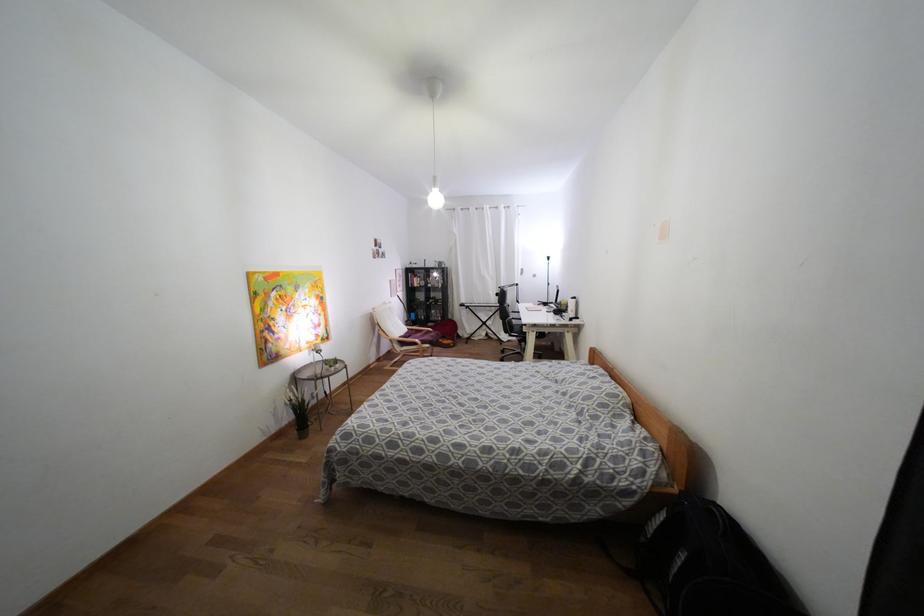
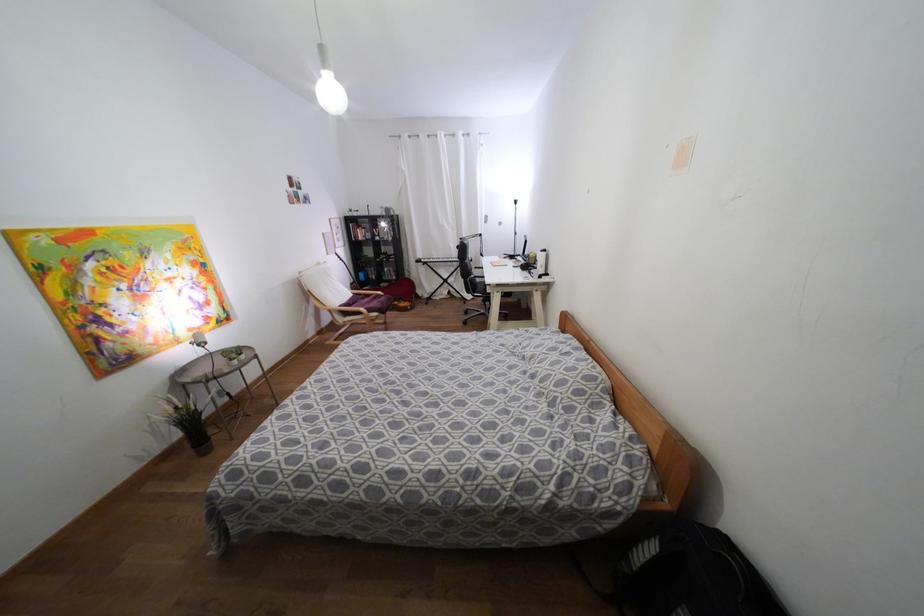
Question: The first image is from the beginning of the video and the second image is from the end. How did the camera likely rotate when shooting the video?

Choices:
 (A) Left
 (B) Right
 (C) Up
 (D) Down

Answer: (D)